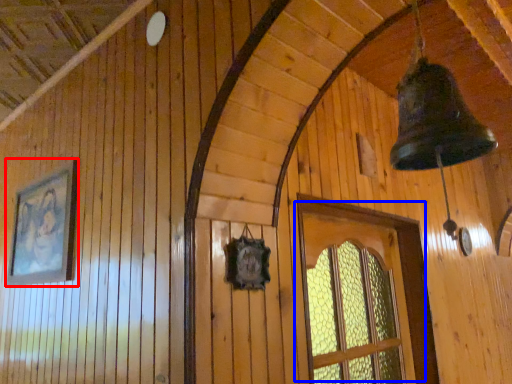
Question: Among these objects, which one is farthest to the camera, picture frame (highlighted by a red box) or window (highlighted by a blue box)?

Choices:
 (A) picture frame
 (B) window

Answer: (A)